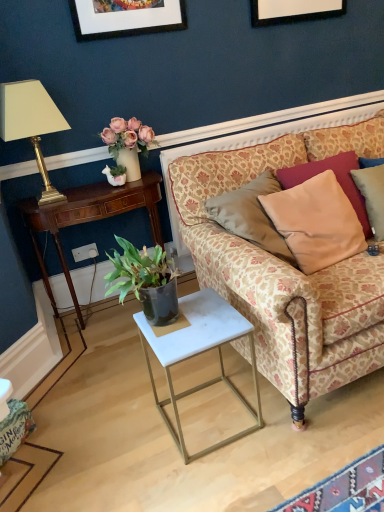
Locate an element on the screen. The height and width of the screenshot is (512, 384). vacant space situated above white marble table at lower center (from a real-world perspective) is located at coordinates (193, 331).